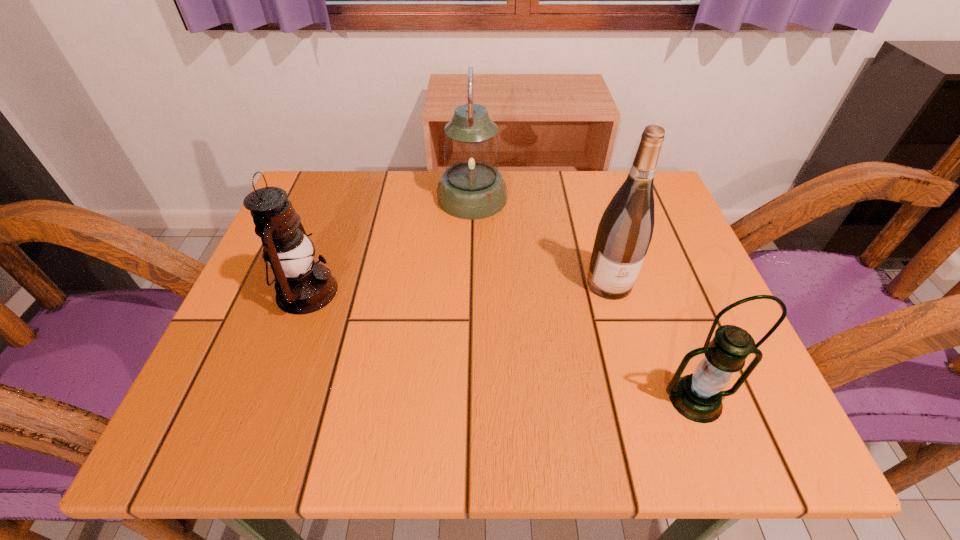
Find the location of a particular element. vacant point located between the wine bottle and the nearest object is located at coordinates (x=653, y=341).

Identify which object is located as the second nearest to the nearest object. Please provide its 2D coordinates. Your answer should be formatted as a tuple, i.e. [(x, y)], where the tuple contains the x and y coordinates of a point satisfying the conditions above.

[(471, 188)]

Where is `object that is the nearest to the second object from left to right`? The height and width of the screenshot is (540, 960). object that is the nearest to the second object from left to right is located at coordinates (624, 233).

The image size is (960, 540). What are the coordinates of `lantern that is the second closest to the second farthest lantern` in the screenshot? It's located at (698, 397).

Where is `lantern identified as the closest to the second nearest lantern`? lantern identified as the closest to the second nearest lantern is located at coordinates (471, 188).

This screenshot has height=540, width=960. I want to click on free location that satisfies the following two spatial constraints: 1. on the label of the wine bottle; 2. on the side of the leftmost object, there is a wick adjustment knob, so click(612, 292).